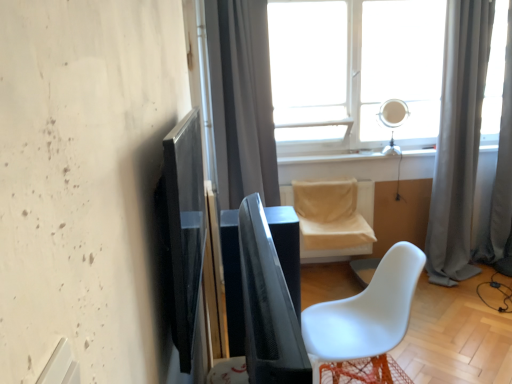
Locate an element on the screen. The width and height of the screenshot is (512, 384). transparent glass window at upper center is located at coordinates (354, 71).

What do you see at coordinates (334, 217) in the screenshot? The height and width of the screenshot is (384, 512). I see `beige fabric chair at center, the first chair positioned from the back` at bounding box center [334, 217].

At what (x,y) coordinates should I click in order to perform the action: click on beige fabric chair at center, the first chair positioned from the back. Please return your answer as a coordinate pair (x, y). The height and width of the screenshot is (384, 512). Looking at the image, I should click on (334, 217).

The height and width of the screenshot is (384, 512). What do you see at coordinates (184, 229) in the screenshot?
I see `black glossy screen door at left` at bounding box center [184, 229].

Describe the element at coordinates (248, 101) in the screenshot. The width and height of the screenshot is (512, 384). I see `gray fabric curtain at upper center, which ranks as the 3th curtain in right-to-left order` at that location.

You are a GUI agent. You are given a task and a screenshot of the screen. Output one action in this format:
    pyautogui.click(x=<x>, y=<y>)
    Task: Click on the transparent glass window at upper center
    The width and height of the screenshot is (512, 384).
    Given the screenshot: What is the action you would take?
    pyautogui.click(x=354, y=71)

Is beige fabric chair at center, the second chair in the front-to-back sequence, closer to camera compared to gray fabric curtain at upper center, arranged as the first curtain when viewed from the left?

No.

Are beige fabric chair at center, the second chair in the front-to-back sequence, and gray fabric curtain at upper center, which ranks as the 3th curtain in right-to-left order, beside each other?

There is a gap between beige fabric chair at center, the second chair in the front-to-back sequence, and gray fabric curtain at upper center, which ranks as the 3th curtain in right-to-left order.

Considering the sizes of objects beige fabric chair at center, the second chair in the front-to-back sequence, and gray fabric curtain at upper center, which ranks as the 3th curtain in right-to-left order, in the image provided, who is taller, beige fabric chair at center, the second chair in the front-to-back sequence, or gray fabric curtain at upper center, which ranks as the 3th curtain in right-to-left order,?

gray fabric curtain at upper center, which ranks as the 3th curtain in right-to-left order, is taller.

Based on the photo, is beige fabric chair at center, the second chair in the front-to-back sequence, completely or partially outside of gray fabric curtain at upper center, arranged as the first curtain when viewed from the left?

That's correct, beige fabric chair at center, the second chair in the front-to-back sequence, is outside of gray fabric curtain at upper center, arranged as the first curtain when viewed from the left.

In terms of size, does gray fabric curtain at upper center, arranged as the first curtain when viewed from the left, appear bigger or smaller than black glossy screen door at left?

In the image, gray fabric curtain at upper center, arranged as the first curtain when viewed from the left, appears to be larger than black glossy screen door at left.

Is black glossy screen door at left at the back of gray fabric curtain at upper center, arranged as the first curtain when viewed from the left?

No, gray fabric curtain at upper center, arranged as the first curtain when viewed from the left, is not facing the opposite direction of black glossy screen door at left.

Between gray fabric curtain at upper center, which ranks as the 3th curtain in right-to-left order, and black glossy screen door at left, which one appears on the right side from the viewer's perspective?

Positioned to the right is gray fabric curtain at upper center, which ranks as the 3th curtain in right-to-left order.

From the image's perspective, who appears lower, gray fabric curtain at upper center, which ranks as the 3th curtain in right-to-left order, or black glossy screen door at left?

black glossy screen door at left.

From the image's perspective, is black glossy speaker at center located beneath gray fabric curtain at right, the third curtain from the left?

Indeed, from the image's perspective, black glossy speaker at center is shown beneath gray fabric curtain at right, the third curtain from the left.

Locate an element on the screen. The width and height of the screenshot is (512, 384). table that is in front of the gray fabric curtain at right, the third curtain from the left is located at coordinates pyautogui.click(x=233, y=281).

From a real-world perspective, between black glossy speaker at center and gray fabric curtain at right, the third curtain from the left, who is vertically higher?

gray fabric curtain at right, the third curtain from the left, is physically above.

Is black glossy speaker at center aimed at gray fabric curtain at right, the third curtain from the left?

No.

Locate an element on the screen. the 1st curtain counting from the right of the gray fabric curtain at upper center, which ranks as the 3th curtain in right-to-left order is located at coordinates (458, 140).

Is gray fabric curtain at upper center, which ranks as the 3th curtain in right-to-left order, positioned with its back to gray fabric curtain at right, which is the 2th curtain from right to left?

No.

Can gray fabric curtain at right, which appears as the second curtain when viewed from the left, be found inside gray fabric curtain at upper center, which ranks as the 3th curtain in right-to-left order?

No, gray fabric curtain at right, which appears as the second curtain when viewed from the left, is located outside of gray fabric curtain at upper center, which ranks as the 3th curtain in right-to-left order.

Based on their sizes in the image, would you say gray fabric curtain at right, which appears as the second curtain when viewed from the left, is bigger or smaller than gray fabric curtain at upper center, which ranks as the 3th curtain in right-to-left order?

Considering their sizes, gray fabric curtain at right, which appears as the second curtain when viewed from the left, takes up more space than gray fabric curtain at upper center, which ranks as the 3th curtain in right-to-left order.

Is gray fabric curtain at right, which appears as the second curtain when viewed from the left, wider or thinner than gray fabric curtain at upper center, which ranks as the 3th curtain in right-to-left order?

Clearly, gray fabric curtain at right, which appears as the second curtain when viewed from the left, has less width compared to gray fabric curtain at upper center, which ranks as the 3th curtain in right-to-left order.

Would you say gray fabric curtain at right, which is the 2th curtain from right to left, is a long distance from gray fabric curtain at upper center, arranged as the first curtain when viewed from the left?

Yes, gray fabric curtain at right, which is the 2th curtain from right to left, and gray fabric curtain at upper center, arranged as the first curtain when viewed from the left, are quite far apart.

Which curtain is the 1st one when counting from the back of the gray fabric curtain at upper center, arranged as the first curtain when viewed from the left? Please provide its 2D coordinates.

[(458, 140)]

How different are the orientations of transparent glass window at upper center and black glossy speaker at center in degrees?

The angular difference between transparent glass window at upper center and black glossy speaker at center is 90.9 degrees.

Is transparent glass window at upper center next to black glossy speaker at center?

No, transparent glass window at upper center is not in contact with black glossy speaker at center.

From the picture: From a real-world perspective, is transparent glass window at upper center below black glossy speaker at center?

Actually, transparent glass window at upper center is physically above black glossy speaker at center in the real world.

Could black glossy speaker at center be considered to be inside transparent glass window at upper center?

No, black glossy speaker at center is not inside transparent glass window at upper center.

Would you say gray fabric curtain at upper center, which ranks as the 3th curtain in right-to-left order, is outside transparent glass window at upper center?

gray fabric curtain at upper center, which ranks as the 3th curtain in right-to-left order, lies outside transparent glass window at upper center's area.

Based on the photo, is gray fabric curtain at upper center, which ranks as the 3th curtain in right-to-left order, facing towards transparent glass window at upper center?

No, gray fabric curtain at upper center, which ranks as the 3th curtain in right-to-left order, does not turn towards transparent glass window at upper center.

Considering the sizes of objects gray fabric curtain at upper center, arranged as the first curtain when viewed from the left, and transparent glass window at upper center in the image provided, who is shorter, gray fabric curtain at upper center, arranged as the first curtain when viewed from the left, or transparent glass window at upper center?

transparent glass window at upper center.

Which is behind, gray fabric curtain at upper center, which ranks as the 3th curtain in right-to-left order, or transparent glass window at upper center?

transparent glass window at upper center is behind.

The image size is (512, 384). What are the coordinates of `curtain that is the 3rd object located above the beige fabric chair at center, the first chair positioned from the back (from the image's perspective)` in the screenshot? It's located at (248, 101).

Locate an element on the screen. The width and height of the screenshot is (512, 384). screen door on the left of gray fabric curtain at upper center, which ranks as the 3th curtain in right-to-left order is located at coordinates (184, 229).

Looking at the image, which one is located closer to transparent glass window at upper center, gray fabric curtain at upper center, arranged as the first curtain when viewed from the left, or gray fabric curtain at right, which appears as the second curtain when viewed from the left?

→ The object closer to transparent glass window at upper center is gray fabric curtain at upper center, arranged as the first curtain when viewed from the left.

Which object lies nearer to the anchor point black glossy screen door at left, gray fabric curtain at right, the first curtain viewed from the right, or white matte chair at lower right, the second chair positioned from the back?

white matte chair at lower right, the second chair positioned from the back, is positioned closer to the anchor black glossy screen door at left.

Looking at the image, which one is located further to gray fabric curtain at upper center, which ranks as the 3th curtain in right-to-left order, transparent glass window at upper center or black glossy speaker at center?

black glossy speaker at center is further to gray fabric curtain at upper center, which ranks as the 3th curtain in right-to-left order.

Which object lies nearer to the anchor point transparent glass window at upper center, gray fabric curtain at right, which appears as the second curtain when viewed from the left, or beige fabric chair at center, the second chair in the front-to-back sequence?

gray fabric curtain at right, which appears as the second curtain when viewed from the left.

Looking at the image, which one is located further to transparent glass window at upper center, white matte chair at lower right, the second chair positioned from the back, or black glossy screen door at left?

The object further to transparent glass window at upper center is black glossy screen door at left.

When comparing their distances from black glossy screen door at left, does gray fabric curtain at right, which is the 2th curtain from right to left, or gray fabric curtain at right, the third curtain from the left, seem closer?

gray fabric curtain at right, which is the 2th curtain from right to left.

When comparing their distances from black glossy speaker at center, does gray fabric curtain at upper center, arranged as the first curtain when viewed from the left, or beige fabric chair at center, the second chair in the front-to-back sequence, seem further?

The object further to black glossy speaker at center is gray fabric curtain at upper center, arranged as the first curtain when viewed from the left.

Based on their spatial positions, is white matte chair at lower right, the second chair positioned from the back, or gray fabric curtain at right, the first curtain viewed from the right, further from gray fabric curtain at upper center, which ranks as the 3th curtain in right-to-left order?

Based on the image, gray fabric curtain at right, the first curtain viewed from the right, appears to be further to gray fabric curtain at upper center, which ranks as the 3th curtain in right-to-left order.

What are the coordinates of `chair between white matte chair at lower right, the second chair positioned from the back, and gray fabric curtain at right, the third curtain from the left, in the horizontal direction` in the screenshot? It's located at (334, 217).

Locate an element on the screen. table between transparent glass window at upper center and white matte chair at lower right, the second chair positioned from the back, in the vertical direction is located at coordinates (233, 281).

The width and height of the screenshot is (512, 384). I want to click on table between gray fabric curtain at upper center, arranged as the first curtain when viewed from the left, and white matte chair at lower right, which ranks as the first chair in front-to-back order, from top to bottom, so click(x=233, y=281).

This screenshot has width=512, height=384. Identify the location of curtain between black glossy speaker at center and gray fabric curtain at right, the first curtain viewed from the right, in the horizontal direction. (458, 140).